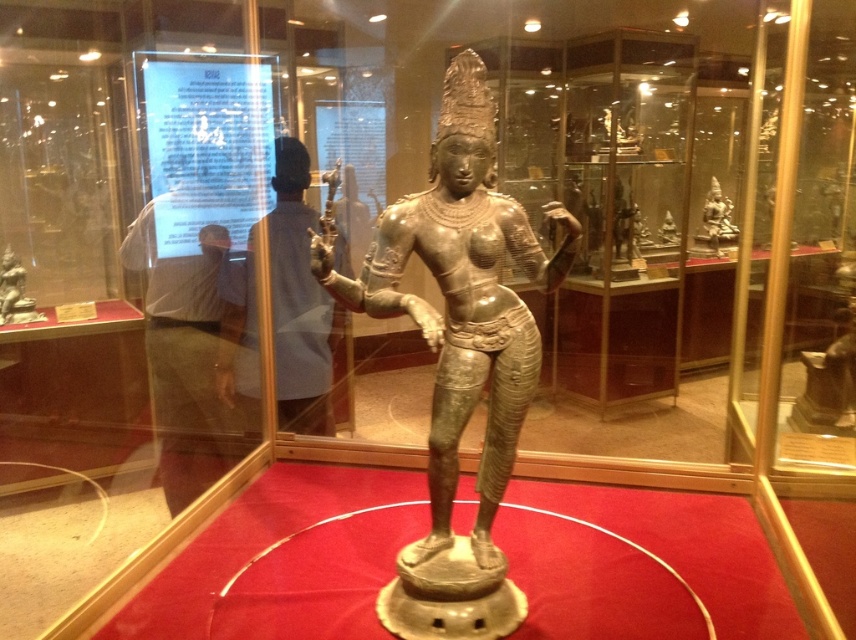
You are a visitor in the museum and want to compare the sizes of the bronze statue at left and the bronze statue at upper right. Which one is taller?

The bronze statue at upper right is taller than the bronze statue at left.

You are an art student preparing a presentation on South Asian deities. You need to compare the sizes of the bronze statue at left and bronze statue at upper right in the museum display. Which one is wider?

The bronze statue at upper right is wider than the bronze statue at left.

You are a security guard in the museum and notice a visitor wearing a blue fabric shirt at upper center standing near the matte gray statue at center. The museum has a rule that visitors must not wear clothing larger than the displayed artifacts. Does the visitor comply with this rule?

The blue fabric shirt at upper center is bigger than the matte gray statue at center, so the visitor does not comply with the museum rule.